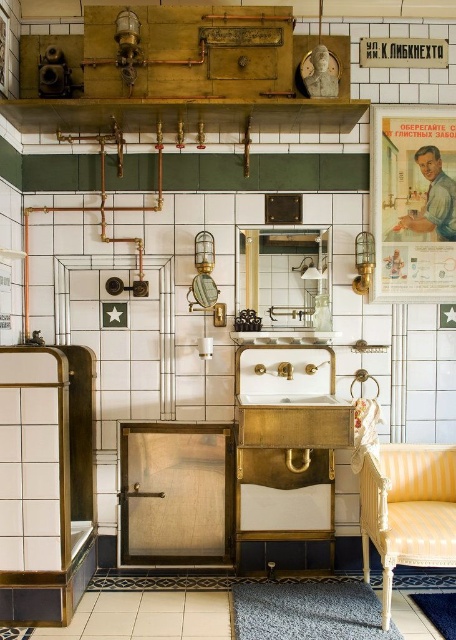
In the scene shown: You are standing in the bathroom and want to place a new decorative item between the matte paper poster at upper right and the yellow striped chair at lower right. Based on their positions, where should you place the item?

The matte paper poster at upper right is to the right of the yellow striped chair at lower right, so you should place the new decorative item between them on the wall between the matte paper poster at upper right and the yellow striped chair at lower right.

In the scene shown: In the vintage bathroom scene, there is a matte paper poster at upper right and a yellow striped chair at lower right. Which object is taller?

The matte paper poster at upper right is taller than the yellow striped chair at lower right.

You are a painter standing in the bathroom and want to place a 30 inch wide canvas between the matte paper poster at upper right and the yellow striped chair at lower right. Can you fit the canvas between them?

The distance between the matte paper poster at upper right and the yellow striped chair at lower right is 39.11 inches. Since the canvas is 30 inches wide, it can fit between them as there is enough space.